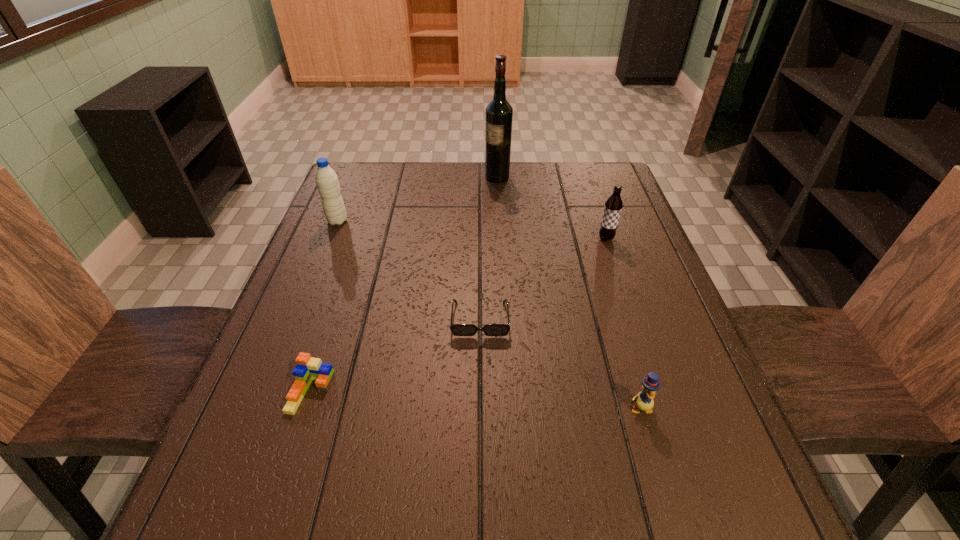
What are the coordinates of `water bottle that is at the left edge` in the screenshot? It's located at (326, 179).

Locate an element on the screen. The image size is (960, 540). Lego that is at the left edge is located at coordinates (308, 368).

You are a GUI agent. You are given a task and a screenshot of the screen. Output one action in this format:
    pyautogui.click(x=<x>, y=<y>)
    Task: Click on the root beer positioned at the right edge
    Image resolution: width=960 pixels, height=540 pixels.
    Given the screenshot: What is the action you would take?
    pyautogui.click(x=613, y=206)

Identify the location of duckling that is at the right edge. (643, 400).

The height and width of the screenshot is (540, 960). Identify the location of vacant space at the far edge of the desktop. (545, 165).

This screenshot has height=540, width=960. Identify the location of vacant space at the near edge. (433, 518).

At what (x,y) coordinates should I click in order to perform the action: click on vacant space at the left edge of the desktop. Please return your answer as a coordinate pair (x, y). The width and height of the screenshot is (960, 540). Looking at the image, I should click on (252, 455).

At what (x,y) coordinates should I click in order to perform the action: click on vacant region at the right edge. Please return your answer as a coordinate pair (x, y). The width and height of the screenshot is (960, 540). Looking at the image, I should click on (738, 451).

Where is `vacant space at the far left corner`? vacant space at the far left corner is located at coordinates (379, 178).

At what (x,y) coordinates should I click in order to perform the action: click on free space at the far right corner. Please return your answer as a coordinate pair (x, y). Looking at the image, I should click on (574, 162).